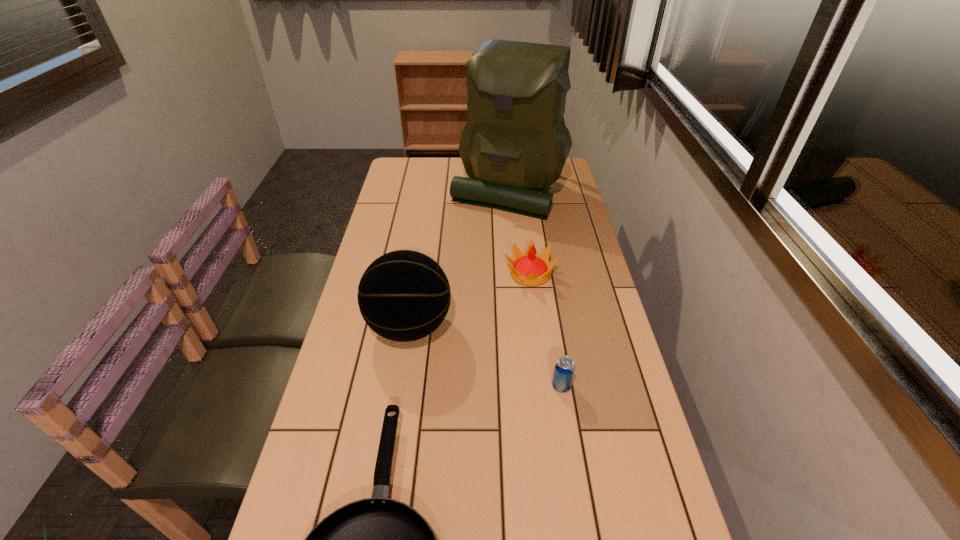
Find the location of a particular element. This screenshot has width=960, height=540. vacant region at the right edge of the desktop is located at coordinates (583, 308).

In the image, there is a desktop. Where is `vacant space at the far left corner`? The image size is (960, 540). vacant space at the far left corner is located at coordinates click(422, 179).

You are a GUI agent. You are given a task and a screenshot of the screen. Output one action in this format:
    pyautogui.click(x=<x>, y=<y>)
    Task: Click on the empty location between the basketball and the farthest object
    
    Given the screenshot: What is the action you would take?
    pyautogui.click(x=459, y=258)

Locate an element on the screen. This screenshot has width=960, height=540. vacant region between the second farthest object and the tallest object is located at coordinates (519, 232).

I want to click on vacant area that lies between the crown and the basketball, so click(469, 300).

Where is `vacant area that lies between the third farthest object and the farthest object`? vacant area that lies between the third farthest object and the farthest object is located at coordinates (459, 258).

I want to click on vacant area between the backpack and the second tallest object, so click(x=459, y=258).

You are a GUI agent. You are given a task and a screenshot of the screen. Output one action in this format:
    pyautogui.click(x=<x>, y=<y>)
    Task: Click on the free spot between the backpack and the basketball
    
    Given the screenshot: What is the action you would take?
    pyautogui.click(x=459, y=258)

At what (x,y) coordinates should I click in order to perform the action: click on blank region between the basketball and the backpack. Please return your answer as a coordinate pair (x, y). Looking at the image, I should click on (459, 258).

Where is `object that stands as the third closest to the nearest object`? This screenshot has width=960, height=540. object that stands as the third closest to the nearest object is located at coordinates (529, 269).